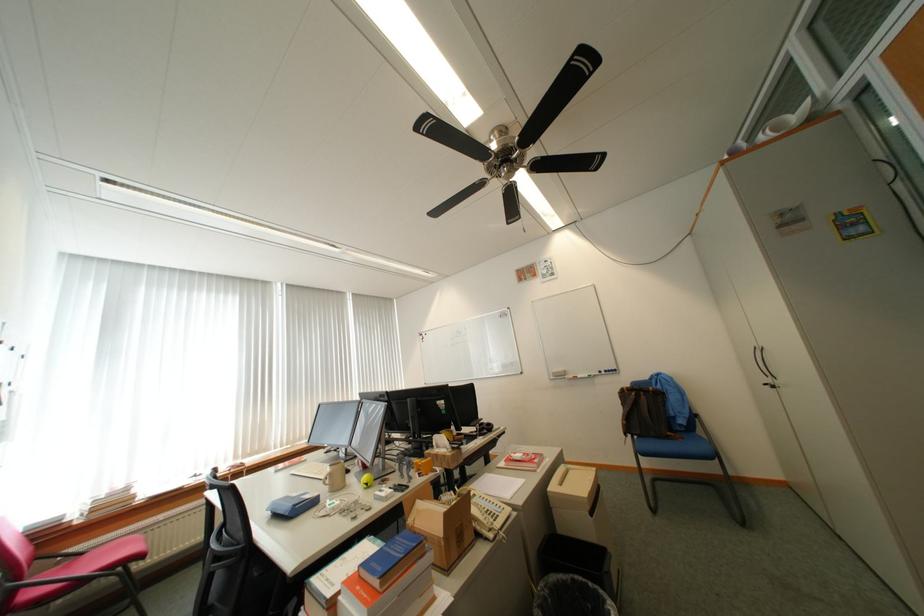
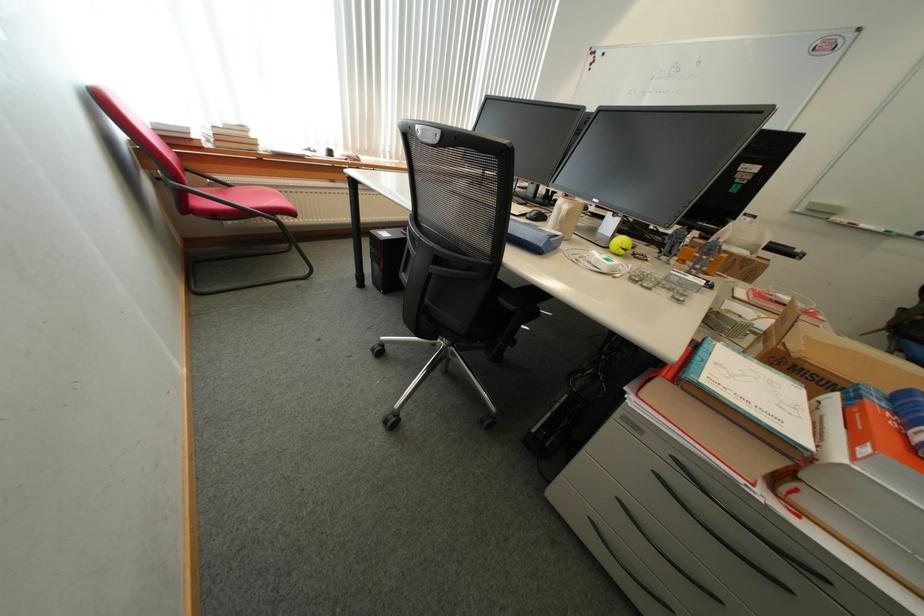
The point at (91, 554) is marked in the first image. Where is the corresponding point in the second image?

(237, 187)